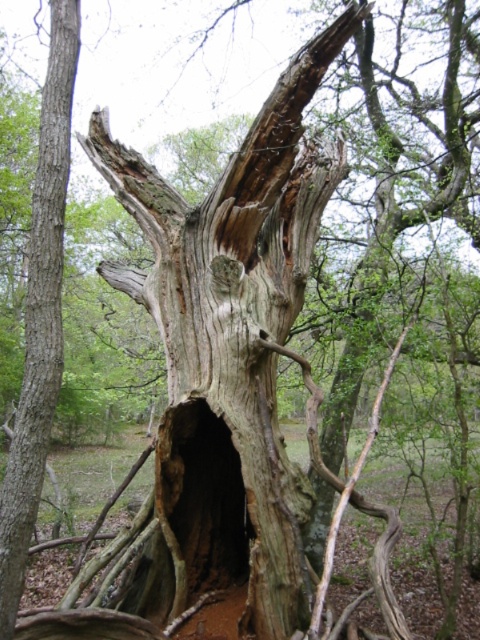
Question: Among these objects, which one is farthest from the camera?

Choices:
 (A) dark wood hole at center
 (B) grayish-brown bark tree trunk at center

Answer: (A)

Question: Does grayish-brown bark tree trunk at center appear on the left side of dark wood hole at center?

Choices:
 (A) no
 (B) yes

Answer: (B)

Question: Which point is closer to the camera?

Choices:
 (A) grayish-brown bark tree trunk at center
 (B) dark wood hole at center

Answer: (A)

Question: Where is grayish-brown bark tree trunk at center located in relation to dark wood hole at center in the image?

Choices:
 (A) left
 (B) right

Answer: (A)

Question: Can you confirm if grayish-brown bark tree trunk at center is positioned above dark wood hole at center?

Choices:
 (A) yes
 (B) no

Answer: (A)